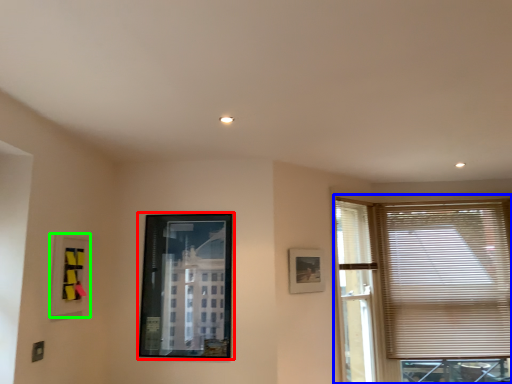
Question: Estimate the real-world distances between objects in this image. Which object is closer to picture frame (highlighted by a red box), window (highlighted by a blue box) or picture frame (highlighted by a green box)?

Choices:
 (A) window
 (B) picture frame

Answer: (B)